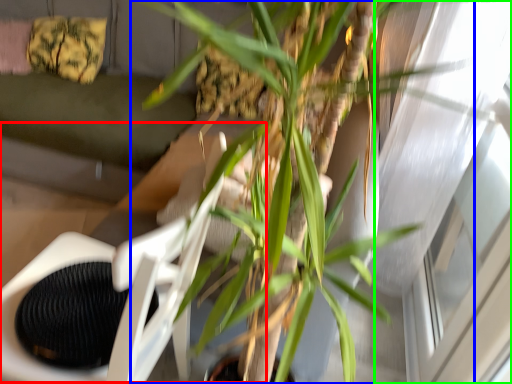
Question: Which is nearer to the swivel chair (highlighted by a red box)? houseplant (highlighted by a blue box) or window (highlighted by a green box).

Choices:
 (A) houseplant
 (B) window

Answer: (A)